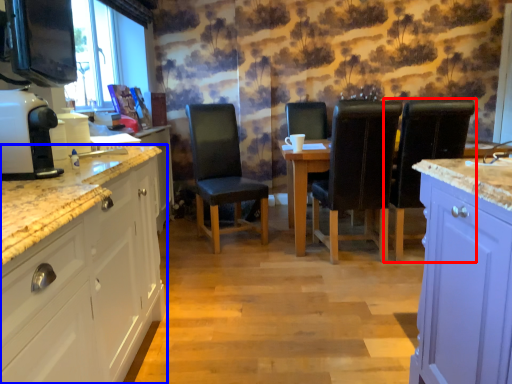
Question: Which object appears farthest to the camera in this image, chair (highlighted by a red box) or cabinetry (highlighted by a blue box)?

Choices:
 (A) chair
 (B) cabinetry

Answer: (A)